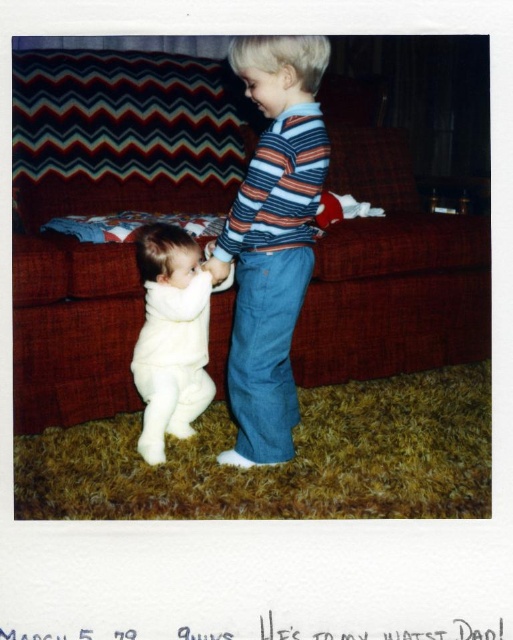
Can you confirm if striped cotton shirt at center is wider than white fuzzy onesie at lower left?

Yes, striped cotton shirt at center is wider than white fuzzy onesie at lower left.

This screenshot has height=640, width=513. Describe the element at coordinates (271, 237) in the screenshot. I see `striped cotton shirt at center` at that location.

Image resolution: width=513 pixels, height=640 pixels. Find the location of `striped cotton shirt at center`. striped cotton shirt at center is located at coordinates (271, 237).